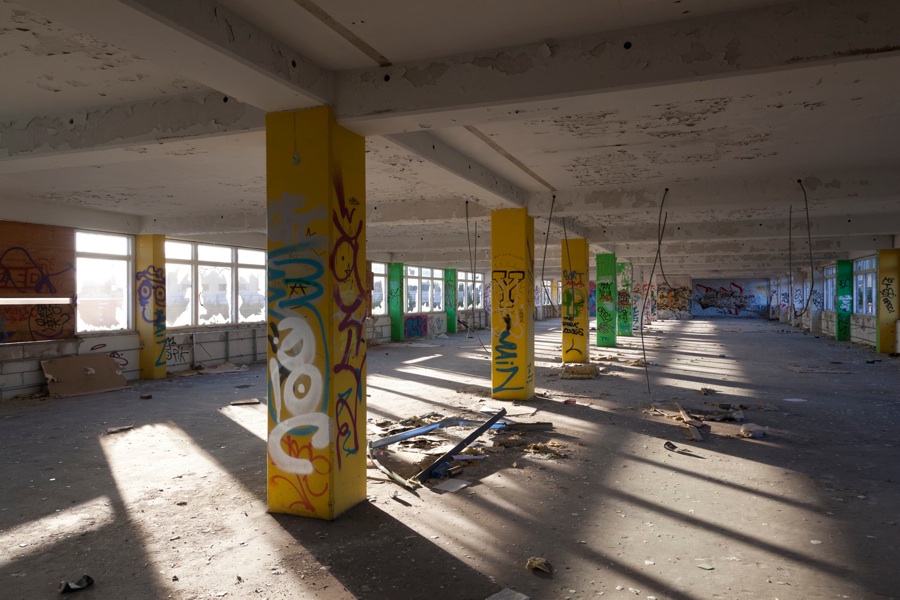
Where is `back wall`? The height and width of the screenshot is (600, 900). back wall is located at coordinates (740, 289), (680, 297), (640, 300).